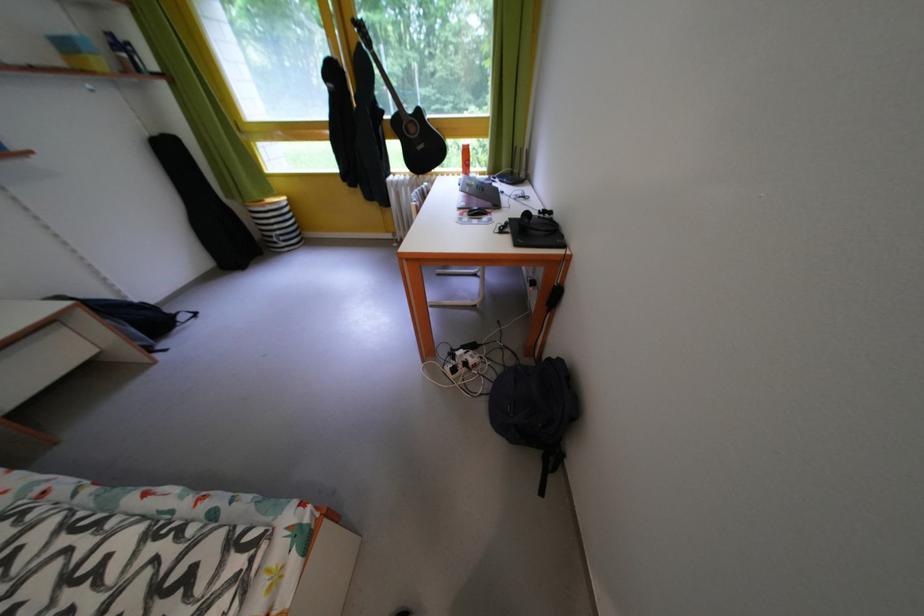
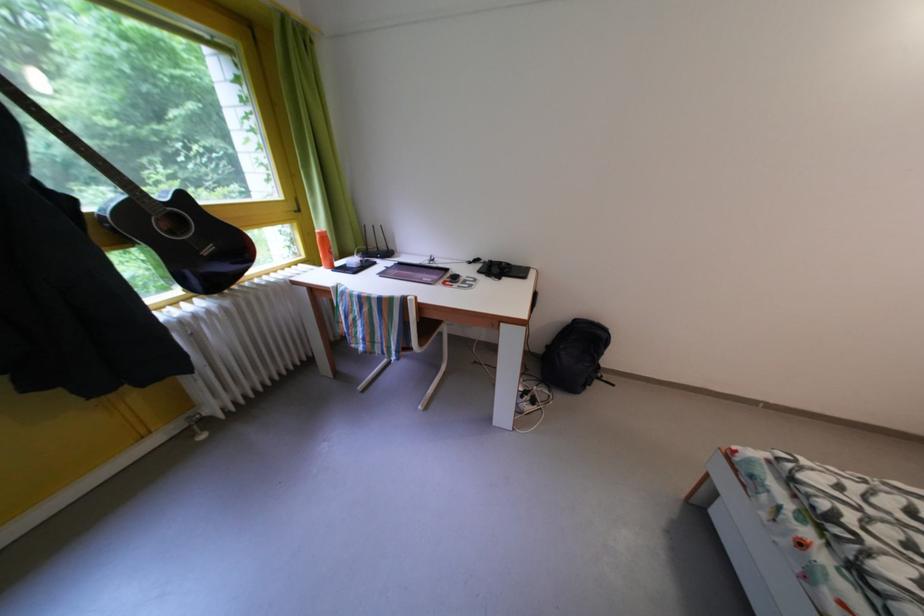
The point at (429, 116) is marked in the first image. Where is the corresponding point in the second image?

(191, 203)